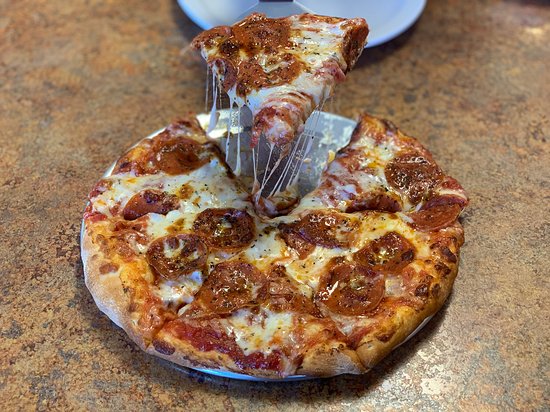
I want to click on plate shadow, so click(x=338, y=385), click(x=371, y=52).